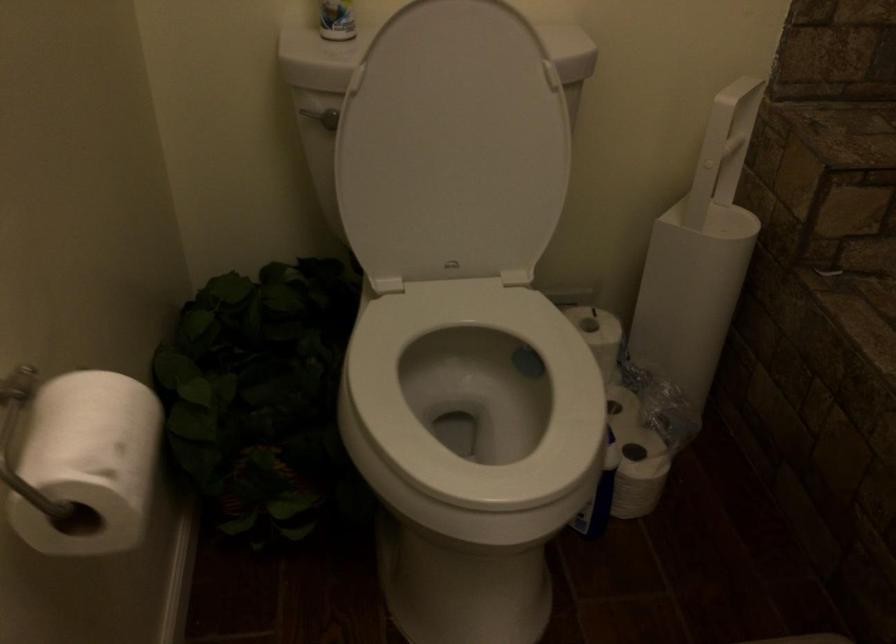
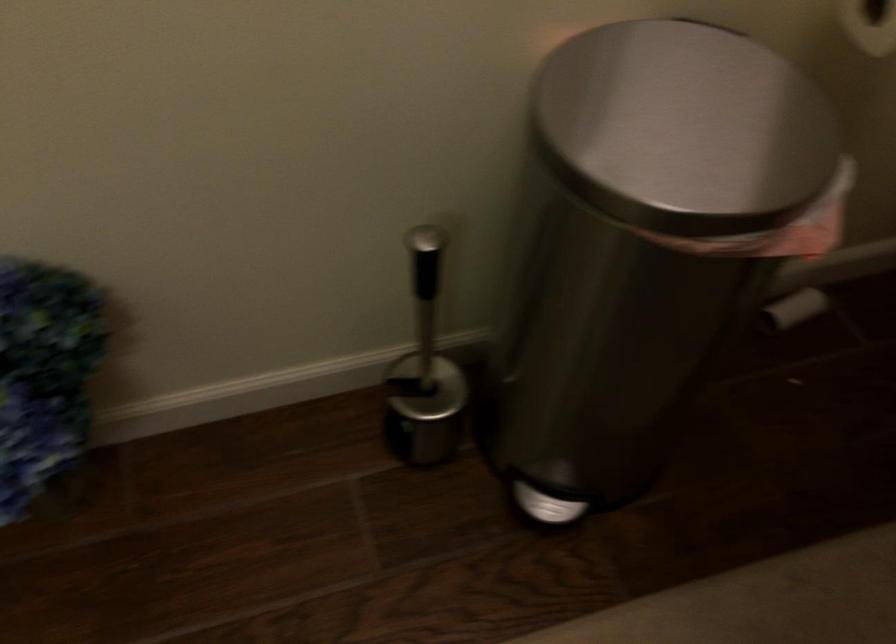
First-person continuous shooting, in which direction is the camera rotating?

The camera's rotation is toward left-down.